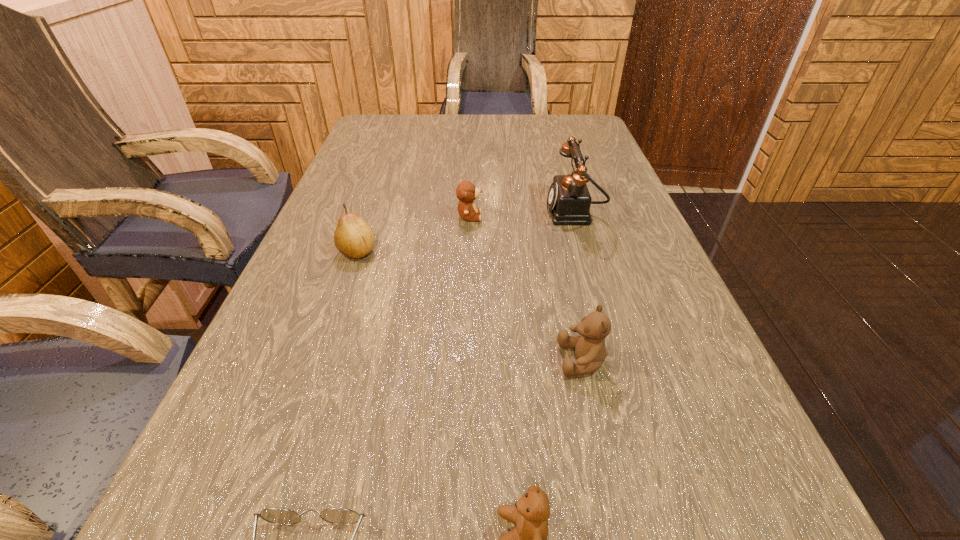
I want to click on free space between the rightmost teddy bear and the pear, so click(470, 306).

Locate an element on the screen. This screenshot has height=540, width=960. vacant space in between the tallest object and the third object from left to right is located at coordinates (521, 214).

At what (x,y) coordinates should I click in order to perform the action: click on empty location between the third nearest object and the farthest teddy bear. Please return your answer as a coordinate pair (x, y). The height and width of the screenshot is (540, 960). Looking at the image, I should click on (526, 288).

Select which object appears as the third closest to the third farthest object. Please provide its 2D coordinates. Your answer should be formatted as a tuple, i.e. [(x, y)], where the tuple contains the x and y coordinates of a point satisfying the conditions above.

[(590, 349)]

Identify which object is the third nearest to the third object from right to left. Please provide its 2D coordinates. Your answer should be formatted as a tuple, i.e. [(x, y)], where the tuple contains the x and y coordinates of a point satisfying the conditions above.

[(353, 237)]

Identify the location of teddy bear object that ranks as the closest to the shortest object. (531, 512).

Identify which teddy bear is the second closest to the telephone. Please provide its 2D coordinates. Your answer should be formatted as a tuple, i.e. [(x, y)], where the tuple contains the x and y coordinates of a point satisfying the conditions above.

[(590, 349)]